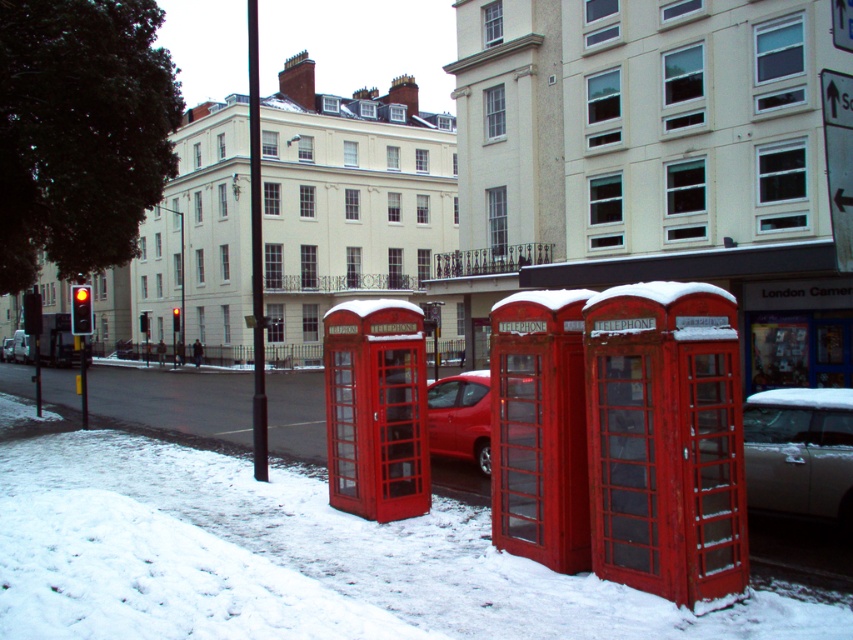
Who is positioned more to the right, snowy red phone booth at center or matte glass telephone booth at center?

snowy red phone booth at center

Is snowy red phone booth at center closer to the viewer compared to matte glass telephone booth at center?

That is True.

Which is in front, point (442, 577) or point (331, 348)?

Point (442, 577) is more forward.

Locate an element on the screen. This screenshot has width=853, height=640. snowy red phone booth at center is located at coordinates (294, 561).

Which is below, snowy red phone booth at center or white glossy car at lower right?

Positioned lower is snowy red phone booth at center.

Image resolution: width=853 pixels, height=640 pixels. What are the coordinates of `snowy red phone booth at center` in the screenshot? It's located at (294, 561).

Measure the distance between point (350, 468) and camera.

A distance of 8.98 meters exists between point (350, 468) and camera.

Who is shorter, matte glass telephone booth at center or shiny red car at center?

shiny red car at center is shorter.

Who is more forward, (328, 433) or (486, 390)?

Point (328, 433)

Find the location of a particular element. Image resolution: width=853 pixels, height=640 pixels. matte glass telephone booth at center is located at coordinates (376, 408).